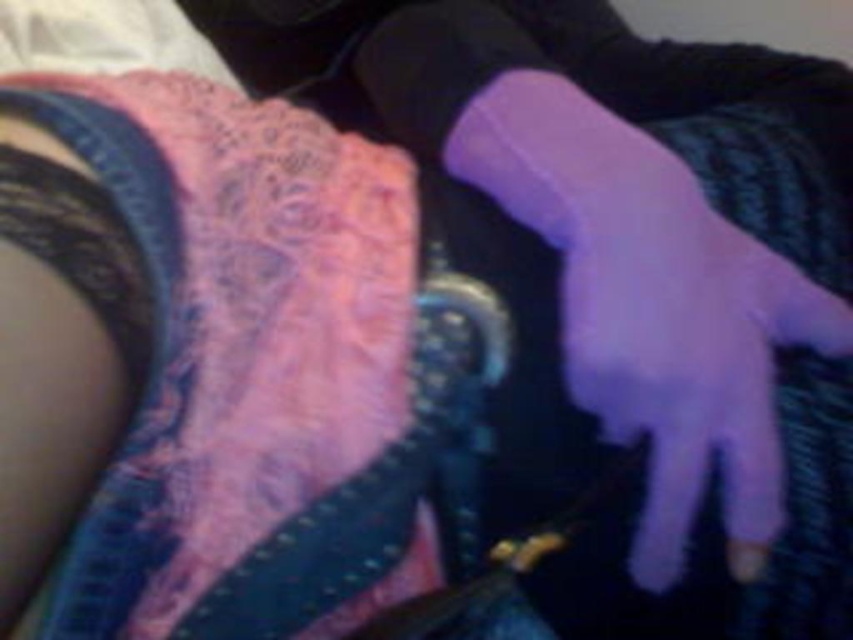
Question: Does purple matte glove at center lie behind purple matte sock at center?

Choices:
 (A) yes
 (B) no

Answer: (B)

Question: Which of the following is the farthest from the observer?

Choices:
 (A) (555, 132)
 (B) (622, 307)

Answer: (A)

Question: Which point is farther to the camera?

Choices:
 (A) purple matte sock at center
 (B) purple matte glove at center

Answer: (A)

Question: Is purple matte glove at center thinner than purple matte sock at center?

Choices:
 (A) yes
 (B) no

Answer: (B)

Question: Which of the following is the farthest from the observer?

Choices:
 (A) (679, 513)
 (B) (618, 144)

Answer: (B)

Question: Is purple matte glove at center further to the viewer compared to purple matte sock at center?

Choices:
 (A) no
 (B) yes

Answer: (A)